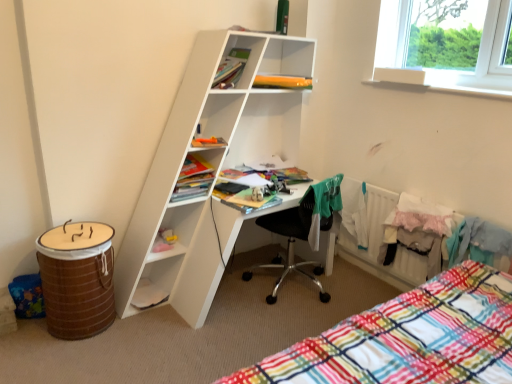
Find the location of a particular element. Image resolution: width=512 pixels, height=384 pixels. vacant space in between white matte desk at center and black mesh chair at center is located at coordinates (244, 320).